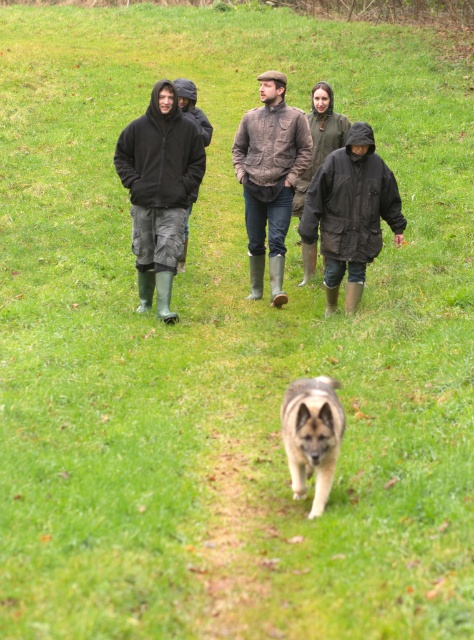
Can you confirm if dark matte jacket at center is smaller than brown leather jacket at center?

No.

Which of these two, dark matte jacket at center or brown leather jacket at center, stands taller?

Standing taller between the two is brown leather jacket at center.

Does point (322, 182) come in front of point (279, 243)?

That is True.

Find the location of a particular element. dark matte jacket at center is located at coordinates (351, 212).

Is dark brown leather jacket at center taller than brown leather jacket at center?

Yes, dark brown leather jacket at center is taller than brown leather jacket at center.

Is dark brown leather jacket at center bigger than brown leather jacket at center?

Yes.

Where is `dark brown leather jacket at center`? dark brown leather jacket at center is located at coordinates (160, 188).

Can you confirm if dark brown leather jacket at center is bigger than dark matte jacket at center?

Yes, dark brown leather jacket at center is bigger than dark matte jacket at center.

Which is in front, point (291, 202) or point (345, 148)?

Point (345, 148) is in front.

Locate an element on the screen. dark brown leather jacket at center is located at coordinates (160, 188).